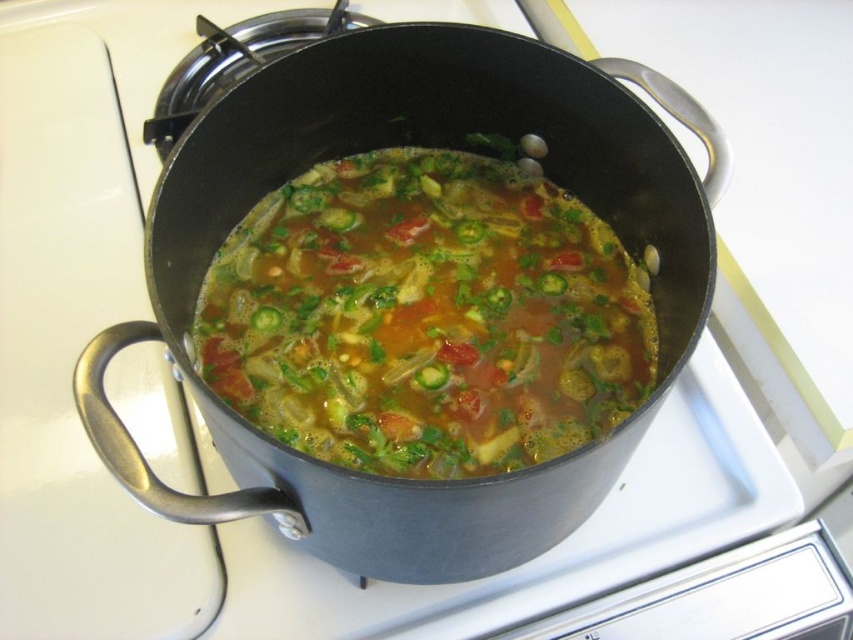
You are standing 20 inches away from the stovetop where the large black pot is placed. You want to reach a point that is at coordinate point (347, 528). Can you reach it without moving closer?

The distance of point (347, 528) from viewer is 21.55 inches, so you are currently 20 inches away from the stovetop. Since the point is 1.55 inches further away than your current position, you cannot reach it without moving closer.

You are a chef preparing a dish and need to know if the black matte pot at center can hold more liquid than the brown glossy soup at center currently has. Based on their sizes, can it?

The black matte pot at center is taller than the brown glossy soup at center, so yes, it can hold more liquid than the current amount in the brown glossy soup at center.

You are a chef preparing a dish and need to know if the brown glossy soup at center can fit entirely into another container that is the same size as the black matte pot at center. Based on the image, can the soup fit into the container?

The black matte pot at center is wider than the brown glossy soup at center, so the soup can fit into a container the same size as the pot since the pot itself can contain the soup.